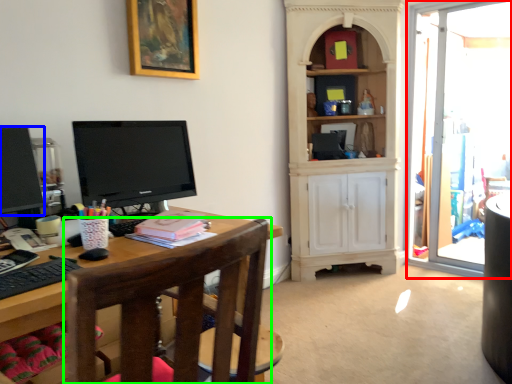
Question: Considering the real-world distances, which object is closest to glass door (highlighted by a red box)? computer monitor (highlighted by a blue box) or chair (highlighted by a green box).

Choices:
 (A) computer monitor
 (B) chair

Answer: (B)